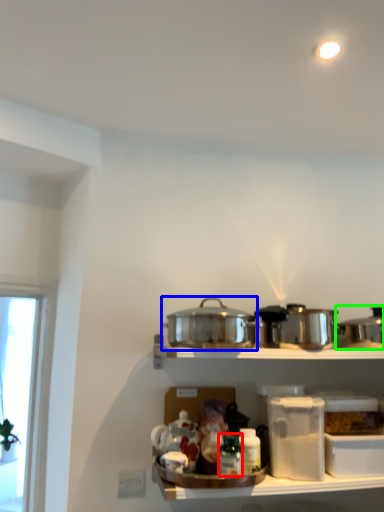
Question: Which object is the closest to the bottle (highlighted by a red box)? Choose among these: crock pot (highlighted by a blue box) or crock pot (highlighted by a green box).

Choices:
 (A) crock pot
 (B) crock pot

Answer: (A)